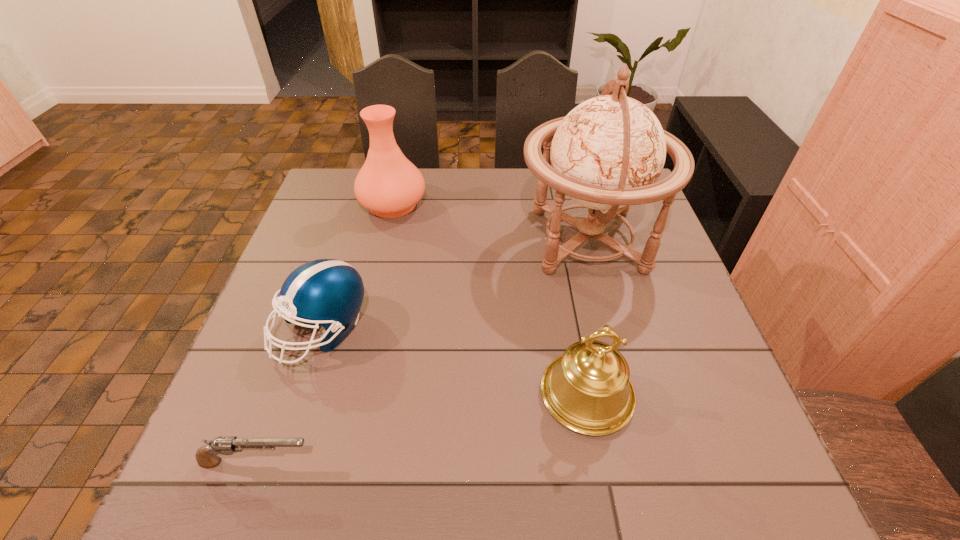
Locate an element on the screen. The height and width of the screenshot is (540, 960). object that is at the far left corner is located at coordinates (389, 185).

Locate an element on the screen. This screenshot has width=960, height=540. object located in the near left corner section of the desktop is located at coordinates (206, 456).

Find the location of a particular element. object that is at the far right corner is located at coordinates (607, 153).

This screenshot has height=540, width=960. In the image, there is a desktop. Find the location of `vacant space at the far edge`. vacant space at the far edge is located at coordinates (513, 179).

In the image, there is a desktop. In order to click on vacant space at the left edge in this screenshot , I will do tap(330, 222).

In the image, there is a desktop. Where is `vacant space at the right edge`? vacant space at the right edge is located at coordinates (627, 295).

This screenshot has width=960, height=540. I want to click on vacant area at the far left corner of the desktop, so click(x=324, y=186).

You are a GUI agent. You are given a task and a screenshot of the screen. Output one action in this format:
    pyautogui.click(x=<x>, y=<y>)
    Task: Click on the free space at the near left corner
    
    Given the screenshot: What is the action you would take?
    pyautogui.click(x=208, y=477)

I want to click on vacant space at the far right corner, so click(x=633, y=211).

Identify the location of free region at the near right corner of the desktop. (751, 453).